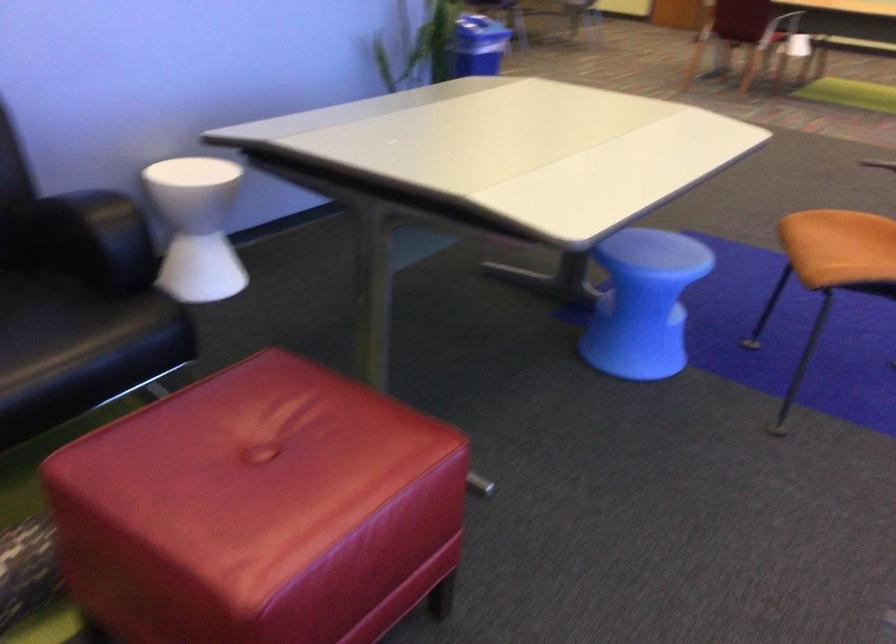
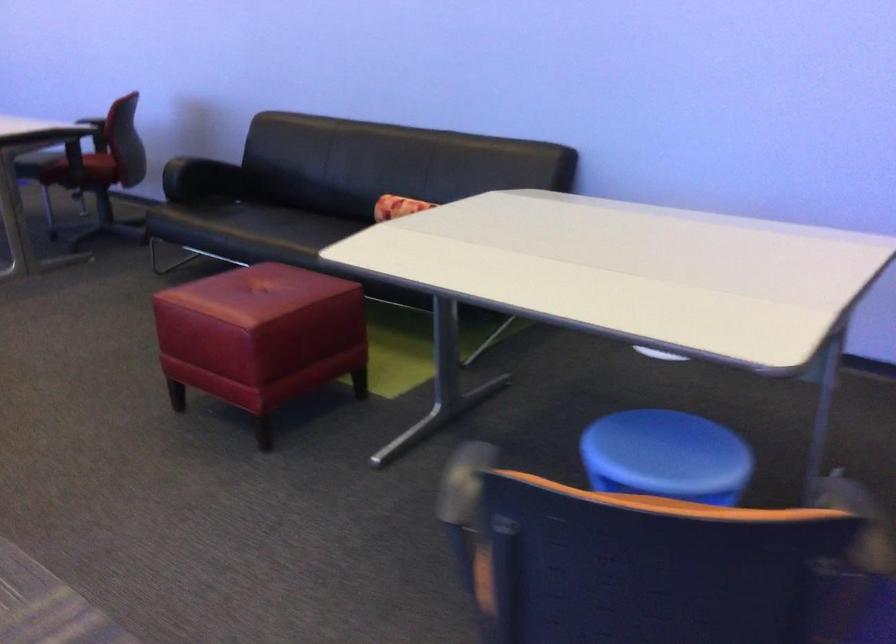
Where in the second image is the point corresponding to the point at 444,449 from the first image?

(261, 337)